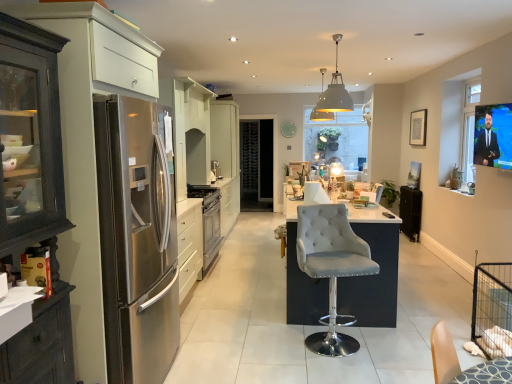
Locate an element on the screen. vacant space in suede-like gray bar stool at center (from a real-world perspective) is located at coordinates (339, 338).